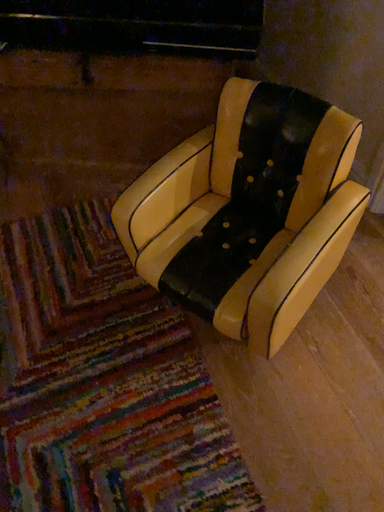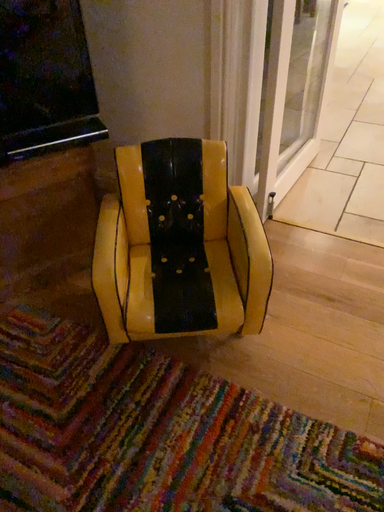
Question: How did the camera likely rotate when shooting the video?

Choices:
 (A) rotated right
 (B) rotated left

Answer: (A)